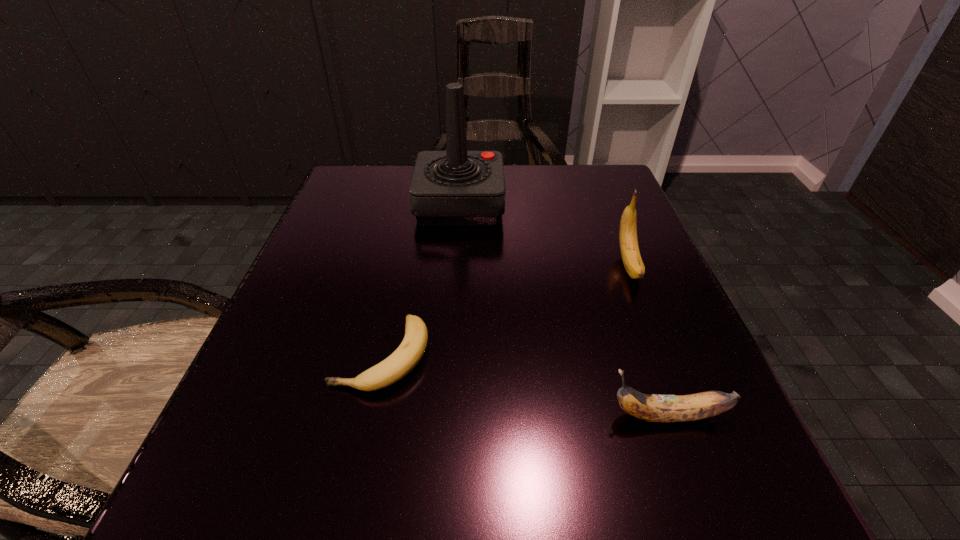
At what (x,y) coordinates should I click in order to perform the action: click on free space between the farthest object and the tallest banana. Please return your answer as a coordinate pair (x, y). Looking at the image, I should click on (544, 235).

Image resolution: width=960 pixels, height=540 pixels. In order to click on free space between the tallest object and the second farthest object in this screenshot , I will do `click(544, 235)`.

Locate which object ranks third in proximity to the third nearest object. Please provide its 2D coordinates. Your answer should be formatted as a tuple, i.e. [(x, y)], where the tuple contains the x and y coordinates of a point satisfying the conditions above.

[(403, 360)]

The height and width of the screenshot is (540, 960). Identify the location of object that is the second closest one to the tallest banana. (653, 408).

I want to click on banana identified as the closest to the leftmost banana, so click(x=653, y=408).

At what (x,y) coordinates should I click in order to perform the action: click on banana that can be found as the third closest to the tallest object. Please return your answer as a coordinate pair (x, y). The image size is (960, 540). Looking at the image, I should click on (653, 408).

The height and width of the screenshot is (540, 960). In order to click on free spot that satisfies the following two spatial constraints: 1. at the start of the peel on the third shortest object; 2. at the stem of the nearest object in this screenshot , I will do `click(689, 416)`.